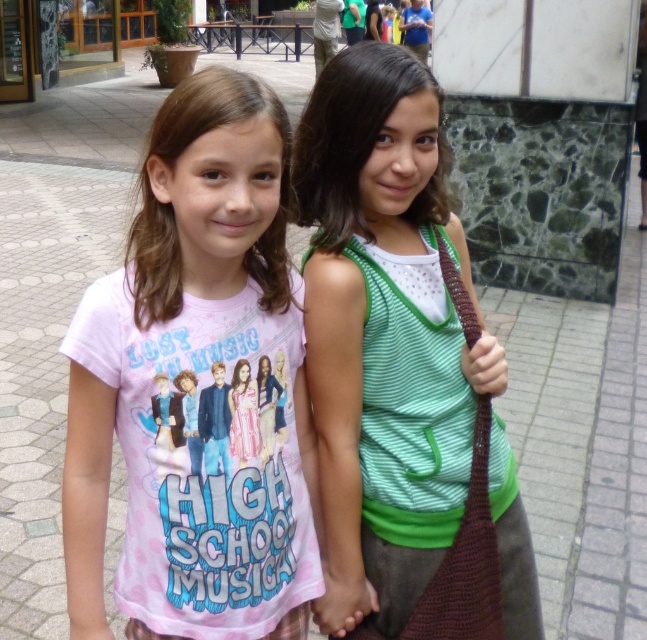
Who is lower down, pink cotton t-shirt at center or green knitted tank top at center?

Positioned lower is pink cotton t-shirt at center.

Does point (102, 604) come farther from viewer compared to point (386, 634)?

No, (102, 604) is closer to viewer.

Between point (175, 602) and point (311, 163), which one is positioned in front?

Positioned in front is point (175, 602).

Identify the location of pink cotton t-shirt at center. (195, 387).